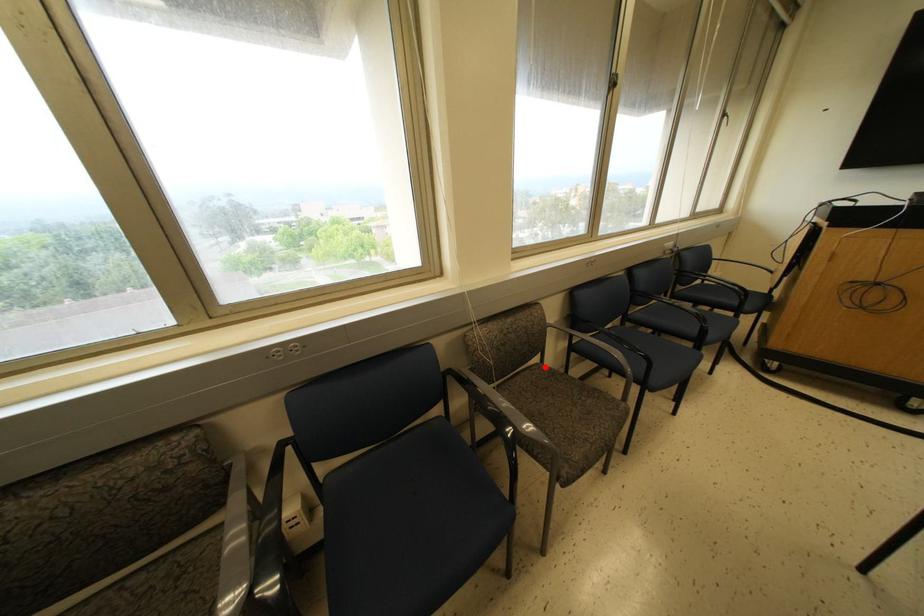
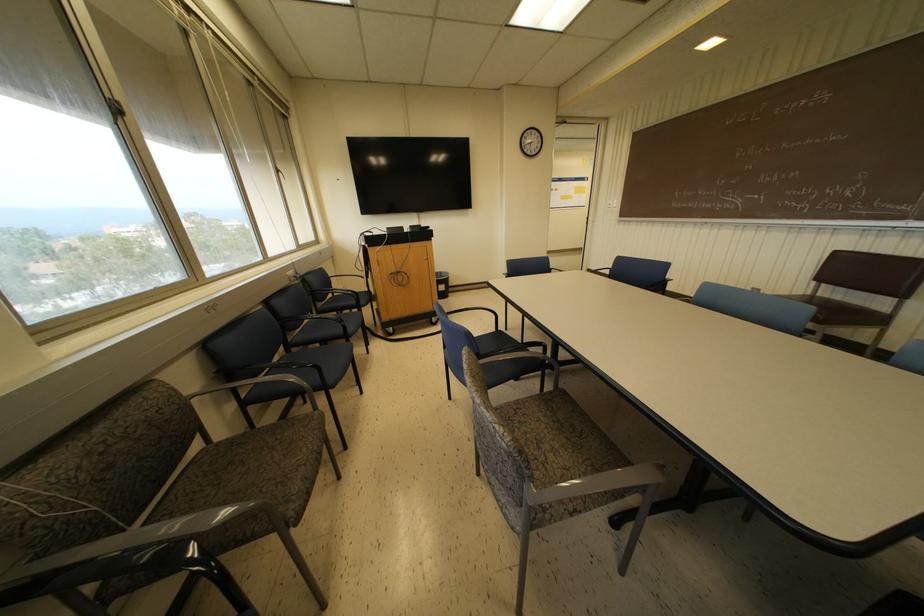
Where in the second image is the point corresponding to the highlighted location from the first image?

(217, 444)